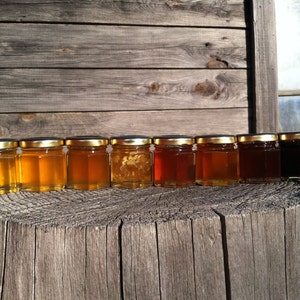
At what (x,y) coordinates should I click in order to perform the action: click on knots in wood. Please return your answer as a coordinate pair (x, y). Image resolution: width=300 pixels, height=300 pixels. Looking at the image, I should click on (201, 88), (153, 86), (27, 117).